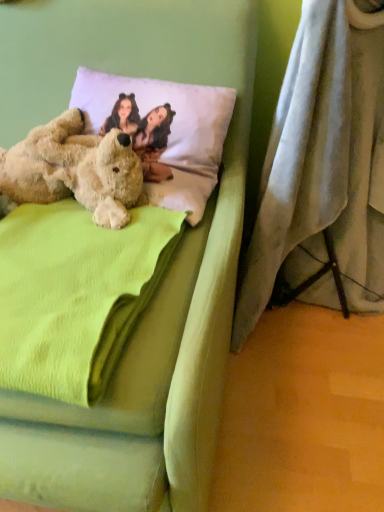
Question: From a real-world perspective, is soft green fabric bed at center located beneath green fleece blanket at center?

Choices:
 (A) yes
 (B) no

Answer: (A)

Question: Is soft green fabric bed at center not close to green fleece blanket at center?

Choices:
 (A) no
 (B) yes

Answer: (A)

Question: Considering the relative positions of soft green fabric bed at center and green fleece blanket at center in the image provided, is soft green fabric bed at center in front of green fleece blanket at center?

Choices:
 (A) yes
 (B) no

Answer: (A)

Question: Is soft green fabric bed at center shorter than green fleece blanket at center?

Choices:
 (A) no
 (B) yes

Answer: (A)

Question: From the image's perspective, is soft green fabric bed at center below green fleece blanket at center?

Choices:
 (A) no
 (B) yes

Answer: (A)

Question: Is soft green fabric bed at center oriented away from green fleece blanket at center?

Choices:
 (A) no
 (B) yes

Answer: (B)

Question: From the image's perspective, is gray fabric curtain at lower right beneath white soft pillow at upper center?

Choices:
 (A) yes
 (B) no

Answer: (A)

Question: Can you confirm if gray fabric curtain at lower right is positioned to the right of white soft pillow at upper center?

Choices:
 (A) no
 (B) yes

Answer: (B)

Question: Is gray fabric curtain at lower right not within white soft pillow at upper center?

Choices:
 (A) yes
 (B) no

Answer: (A)

Question: Is gray fabric curtain at lower right shorter than white soft pillow at upper center?

Choices:
 (A) no
 (B) yes

Answer: (A)

Question: Is gray fabric curtain at lower right with white soft pillow at upper center?

Choices:
 (A) no
 (B) yes

Answer: (A)

Question: From the image's perspective, would you say gray fabric curtain at lower right is positioned over white soft pillow at upper center?

Choices:
 (A) yes
 (B) no

Answer: (B)

Question: Is gray fabric curtain at lower right further to camera compared to soft green fabric bed at center?

Choices:
 (A) yes
 (B) no

Answer: (A)